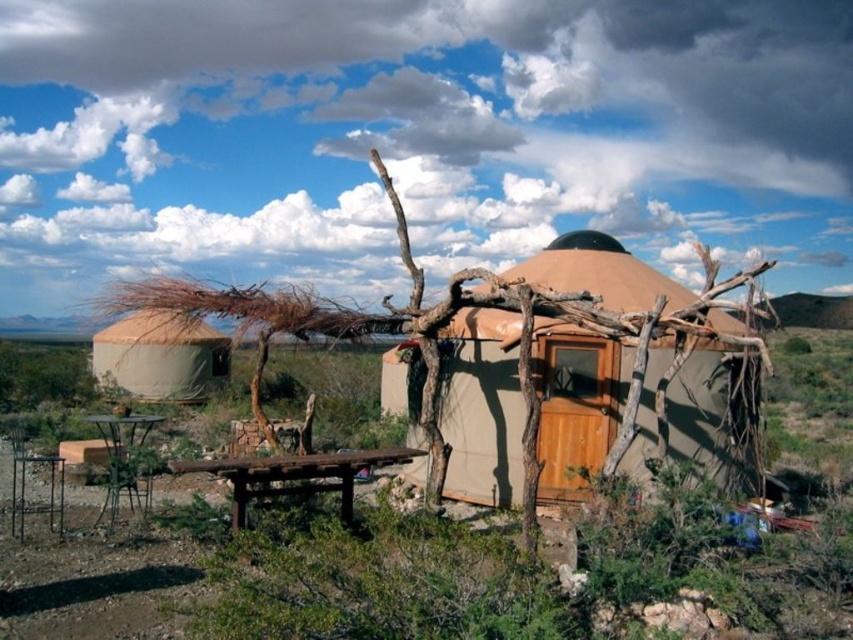
Question: Is beige canvas yurt at center to the left of rusty wood picnic table at lower center from the viewer's perspective?

Choices:
 (A) no
 (B) yes

Answer: (A)

Question: Is rusty wood picnic table at lower center smaller than metallic brown picnic table at lower left?

Choices:
 (A) yes
 (B) no

Answer: (A)

Question: Can you confirm if beige canvas yurt at center is positioned to the left of metallic brown picnic table at lower left?

Choices:
 (A) no
 (B) yes

Answer: (A)

Question: Which point is closer to the camera taking this photo?

Choices:
 (A) (553, 272)
 (B) (114, 458)

Answer: (B)

Question: Estimate the real-world distances between objects in this image. Which object is closer to the metallic brown picnic table at lower left?

Choices:
 (A) beige canvas yurt at left
 (B) beige canvas yurt at center

Answer: (A)

Question: Which object is positioned closest to the rusty wood picnic table at lower center?

Choices:
 (A) metallic brown picnic table at lower left
 (B) beige canvas yurt at left
 (C) beige canvas yurt at center

Answer: (A)